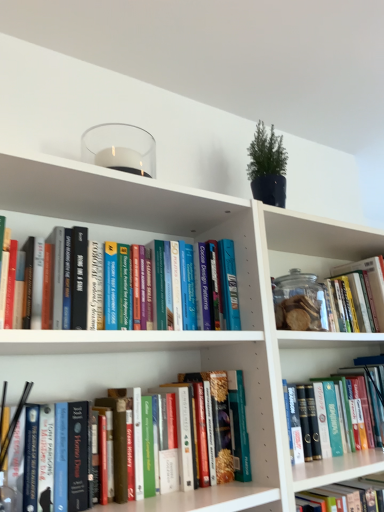
Question: In the image, is white matte bookcase at upper center positioned in front of or behind hardcover book at lower right, which appears as the fifth book when viewed from the top?

Choices:
 (A) behind
 (B) front

Answer: (B)

Question: Is white matte bookcase at upper center inside or outside of hardcover book at lower right, which appears as the fifth book when viewed from the top?

Choices:
 (A) outside
 (B) inside

Answer: (A)

Question: Which object is positioned closest to the transparent glass jar at center-right?

Choices:
 (A) hardcover books at center, positioned as the first book in top-to-bottom order
 (B) hardcover book at lower right, which appears as the fifth book when viewed from the top
 (C) hardcover book at center, positioned as the second book in bottom-to-top order
 (D) hardcover book at center, placed as the third book when sorted from bottom to top
 (E) white matte bookcase at upper center

Answer: (E)

Question: Which of these objects is positioned closest to the hardcover book at center, placed as the third book when sorted from bottom to top?

Choices:
 (A) transparent glass jar at upper right, the 4th book when ordered from bottom to top
 (B) transparent glass jar at center-right
 (C) hardcover book at lower right, arranged as the 1th book when ordered from the bottom
 (D) hardcover books at center, positioned as the first book in top-to-bottom order
 (E) hardcover book at center, positioned as the second book in bottom-to-top order

Answer: (C)